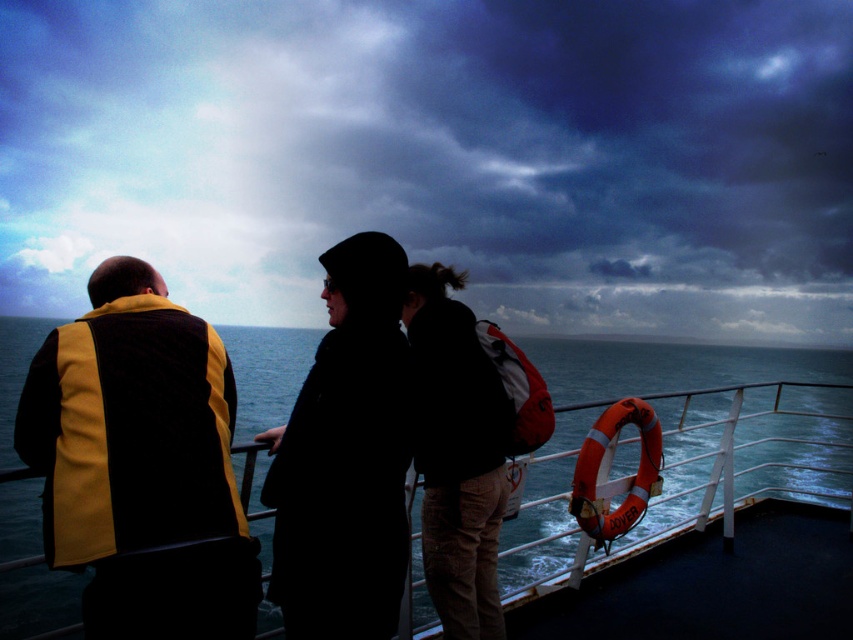
Question: Is dark brown leather jacket at center in front of orange rubber life ring at right?

Choices:
 (A) yes
 (B) no

Answer: (A)

Question: Considering the real-world distances, which object is closest to the dark brown leather jacket at center?

Choices:
 (A) orange rubber life ring at right
 (B) dark fabric coat at center
 (C) rubber lifebuoy at right

Answer: (B)

Question: Which of the following is the closest to the observer?

Choices:
 (A) dark brown leather jacket at center
 (B) dark fabric coat at center
 (C) yellow and black fabric life vest at left
 (D) orange rubber life ring at right

Answer: (C)

Question: Which object is positioned closest to the orange rubber life ring at right?

Choices:
 (A) rubber lifebuoy at right
 (B) dark brown leather jacket at center
 (C) yellow and black fabric life vest at left

Answer: (B)

Question: Is yellow and black fabric life vest at left wider than red fabric backpack at center?

Choices:
 (A) no
 (B) yes

Answer: (B)

Question: Does orange rubber life ring at right have a larger size compared to red fabric backpack at center?

Choices:
 (A) no
 (B) yes

Answer: (B)